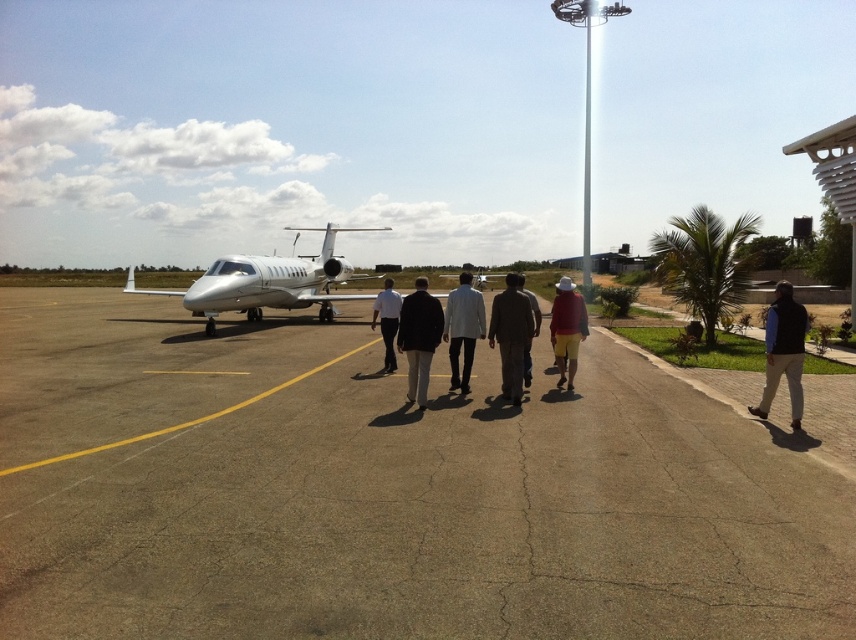
You are a photographer standing at the edge of the airfield, and you want to take a photo of the two people wearing the dark blue vest at center and the white matte shirt at center. Which person should you focus on first if you want to capture the one on the left side of the group?

The white matte shirt at center should be focused on first since it is positioned to the left of the dark blue vest at center, which is on the right side.

You are a photographer taking a picture of the group of six individuals on the tarmac. You notice the dark blue vest at center and the white matte shirt at center. Which clothing item is positioned lower on the person?

The dark blue vest at center is below the white matte shirt at center, so the dark blue vest at center is positioned lower on the person.